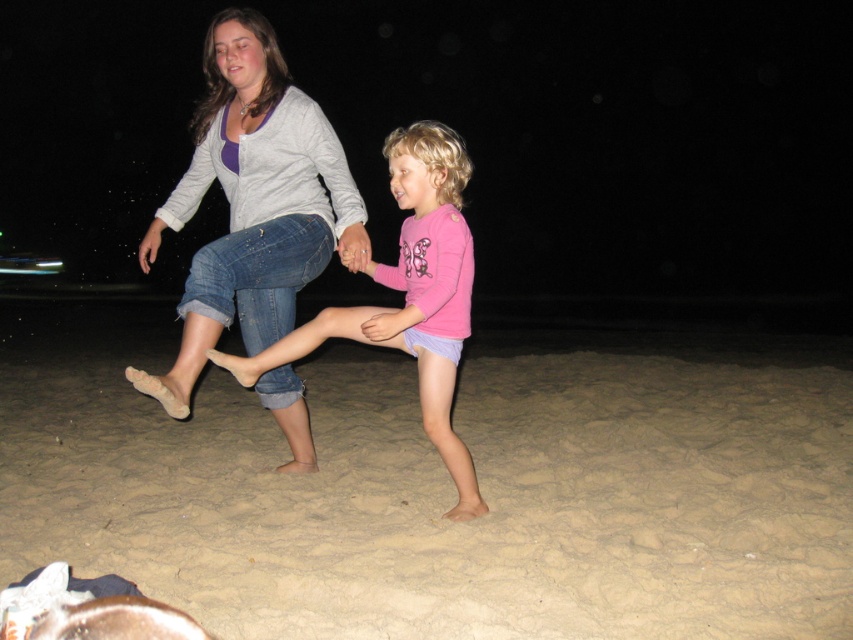
Can you confirm if light brown sandy beach at lower center is shorter than denim jeans at center?

Indeed, light brown sandy beach at lower center has a lesser height compared to denim jeans at center.

Is point (849, 468) farther from camera compared to point (289, 193)?

Yes, point (849, 468) is farther from viewer.

Is point (407, 403) positioned after point (329, 184)?

Yes, it is behind point (329, 184).

The height and width of the screenshot is (640, 853). In order to click on light brown sandy beach at lower center in this screenshot , I will do `click(450, 493)`.

Does light brown sandy beach at lower center appear under pink matte shirt at center?

Correct, light brown sandy beach at lower center is located below pink matte shirt at center.

Is light brown sandy beach at lower center shorter than pink matte shirt at center?

Yes, light brown sandy beach at lower center is shorter than pink matte shirt at center.

The image size is (853, 640). What are the coordinates of `light brown sandy beach at lower center` in the screenshot? It's located at (450, 493).

Where is `denim jeans at center`? This screenshot has width=853, height=640. denim jeans at center is located at coordinates (253, 202).

Can you confirm if denim jeans at center is positioned below pink matte shirt at center?

Actually, denim jeans at center is above pink matte shirt at center.

Identify the location of denim jeans at center. (253, 202).

Image resolution: width=853 pixels, height=640 pixels. What are the coordinates of `denim jeans at center` in the screenshot? It's located at (253, 202).